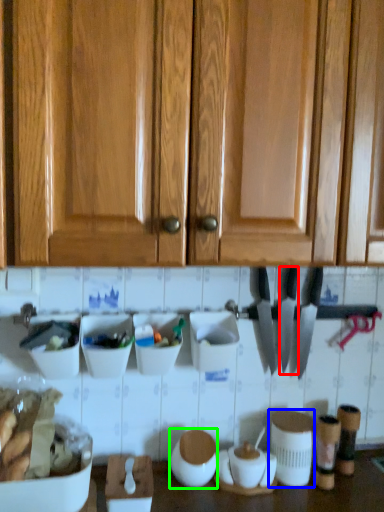
Question: Which object is the farthest from knife (highlighted by a red box)? Choose among these: appliance (highlighted by a blue box) or appliance (highlighted by a green box).

Choices:
 (A) appliance
 (B) appliance

Answer: (B)